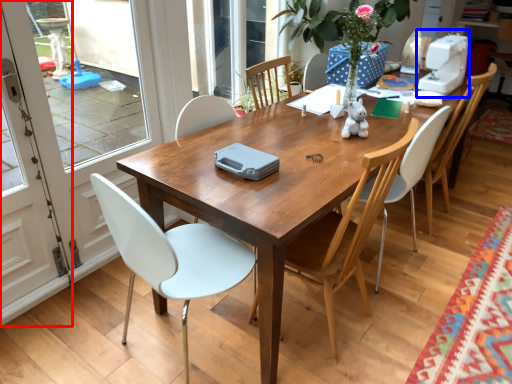
Question: Which object appears farthest to the camera in this image, screen door (highlighted by a red box) or sewing machine (highlighted by a blue box)?

Choices:
 (A) screen door
 (B) sewing machine

Answer: (B)